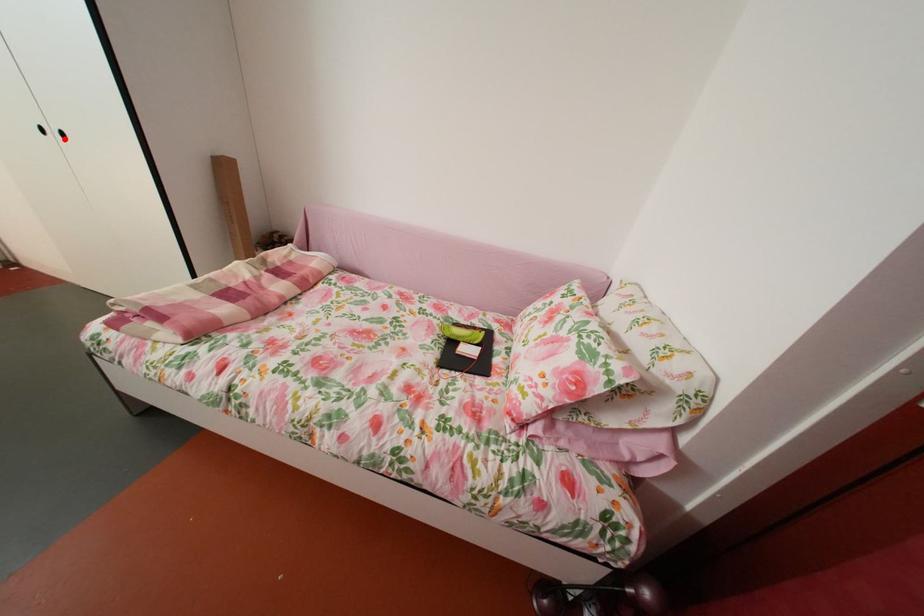
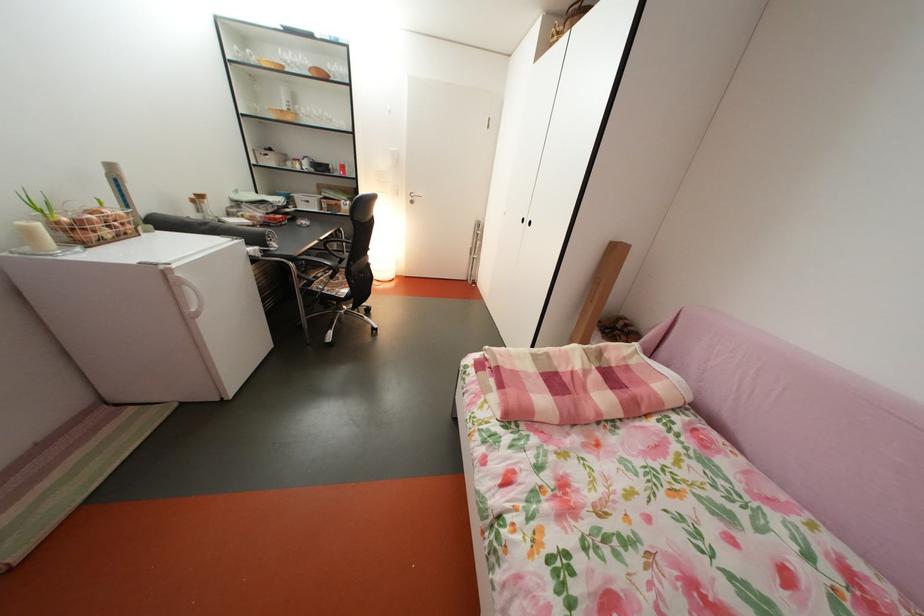
Locate, in the second image, the point that corresponds to the highlighted location in the first image.

(538, 228)